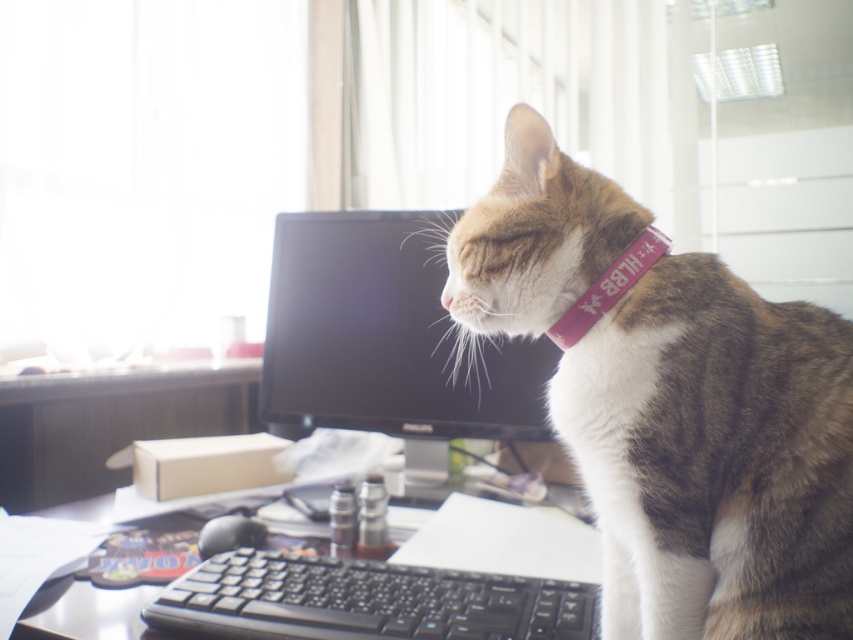
Question: Can you confirm if tabby fur cat at center is positioned below pink fabric neckband at upper center?

Choices:
 (A) yes
 (B) no

Answer: (A)

Question: Which point is farther to the camera?

Choices:
 (A) (627, 480)
 (B) (392, 632)
 (C) (383, 403)
 (D) (550, 330)

Answer: (C)

Question: Can you confirm if tabby fur cat at center is positioned to the left of black glossy monitor at center?

Choices:
 (A) no
 (B) yes

Answer: (A)

Question: Is black plastic keyboard at lower center in front of black plastic keyboard at center?

Choices:
 (A) yes
 (B) no

Answer: (A)

Question: Which point is farther to the camera?

Choices:
 (A) black plastic keyboard at lower center
 (B) pink fabric neckband at upper center
 (C) tabby fur cat at center
 (D) black glossy monitor at center

Answer: (D)

Question: Among these objects, which one is farthest from the camera?

Choices:
 (A) black plastic keyboard at lower center
 (B) black plastic keyboard at center

Answer: (B)